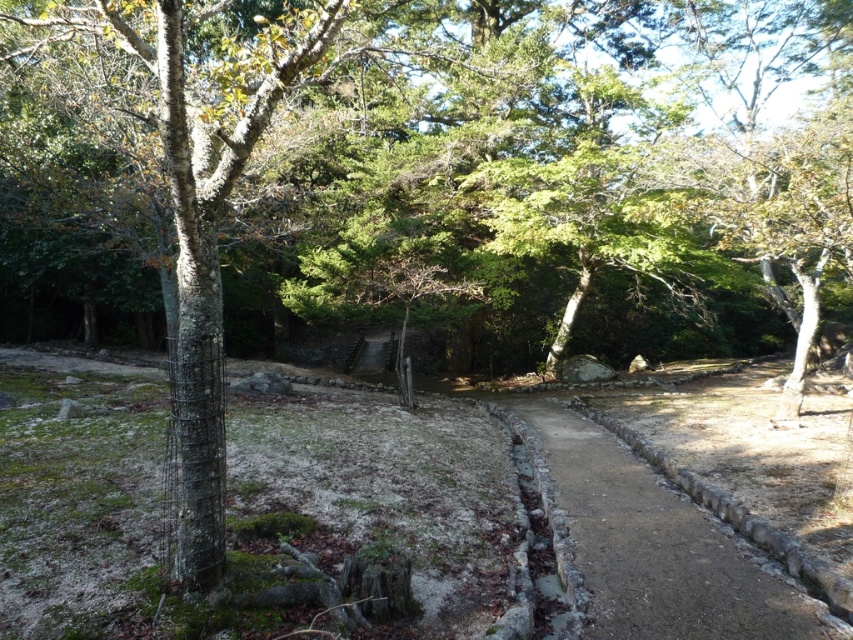
You are a landscape architect designing a new park layout. You need to place a bench along the dirt path at center. Considering the smooth bark tree at left, which has a narrower width, where should you place the bench to ensure it doesn not block the path?

The smooth bark tree at left is narrower than the dirt path at center, so placing the bench along the dirt path at center away from the tree would ensure it doesn not block the path.

You are a landscape architect designing a walking trail. You notice the smooth bark tree at left and the dirt path at center. Which of these two features takes up more visual space in the scene?

The dirt path at center occupies more space than the smooth bark tree at left, so the dirt path at center takes up more visual space in the scene.

You are a hiker walking along the dirt path at center. You want to take a photo of the smooth bark tree at left. Which direction should you face to capture it in your camera?

The smooth bark tree at left is positioned on the left side of the dirt path at center. To capture it, you should face towards the left direction from the dirt path at center.